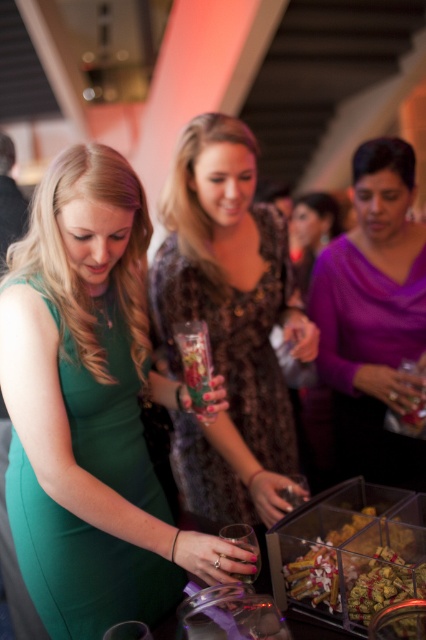
You are at a party and want to hand a drink to the person wearing the purple matte sweater at center without disturbing the printed velvet dress at center. Which direction should you approach from?

You should approach from the front of the purple matte sweater at center since the printed velvet dress at center is behind it, so moving from the front would avoid disturbing the dress.

You are a guest at the party and want to place a small gift on the table between the purple matte sweater at center and the translucent glass vase at center. Is there enough space between them for the gift?

The purple matte sweater at center is positioned on the right side of the translucent glass vase at center, so there is space between them to place the gift.

You are standing in the room and want to reach both points, point [353,292] and point [178,468]. Which point is closer to you?

Point [353,292] is closer to you because it is further to the viewer than point [178,468].